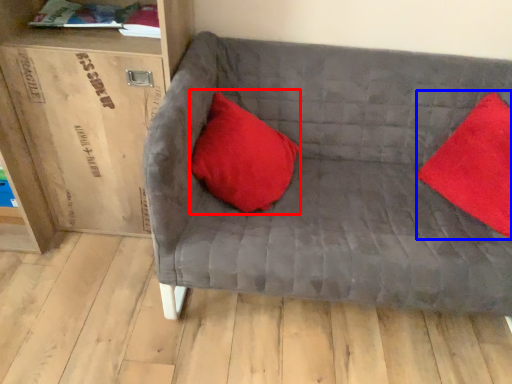
Question: Among these objects, which one is farthest to the camera, pillow (highlighted by a red box) or pillow (highlighted by a blue box)?

Choices:
 (A) pillow
 (B) pillow

Answer: (A)